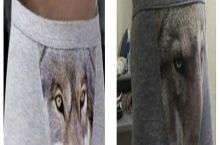
Locate an element on the screen. leopard looking stuffed animal is located at coordinates (126, 103).